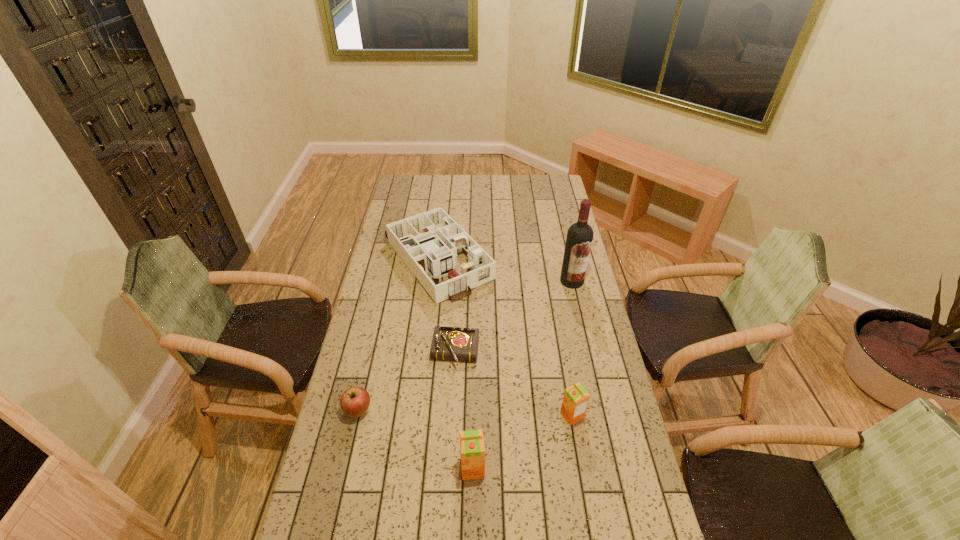
Where is `vacant space at the far edge of the desktop`? vacant space at the far edge of the desktop is located at coordinates [x=445, y=176].

I want to click on vacant position at the near edge of the desktop, so click(x=381, y=513).

The width and height of the screenshot is (960, 540). In the image, there is a desktop. Identify the location of vacant area at the left edge. (391, 222).

Where is `vacant region at the right edge`? vacant region at the right edge is located at coordinates (570, 221).

You are a GUI agent. You are given a task and a screenshot of the screen. Output one action in this format:
    pyautogui.click(x=<x>, y=<y>)
    Task: Click on the free location at the far right corner of the desktop
    Image resolution: width=960 pixels, height=540 pixels.
    Given the screenshot: What is the action you would take?
    pyautogui.click(x=549, y=195)

Locate an element on the screen. vacant region between the second object from right to left and the diary is located at coordinates (514, 384).

Identify the location of free space between the third tallest object and the wine bottle. This screenshot has height=540, width=960. (572, 348).

The width and height of the screenshot is (960, 540). In order to click on vacant area that lies between the nearest object and the tallest object in this screenshot , I will do `click(522, 375)`.

The width and height of the screenshot is (960, 540). I want to click on empty space between the apple and the farther orange juice, so click(x=465, y=414).

At what (x,y) coordinates should I click in order to perform the action: click on vacant space that is in between the tallest object and the farther orange juice. Please return your answer as a coordinate pair (x, y). The width and height of the screenshot is (960, 540). Looking at the image, I should click on (572, 348).